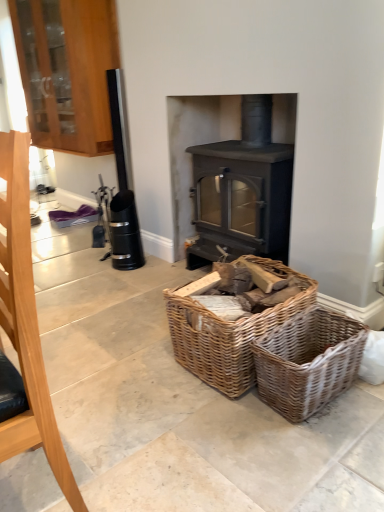
Locate an element on the screen. free space between brushed metal fireplace tool at left and woven brown basket at lower center is located at coordinates (169, 444).